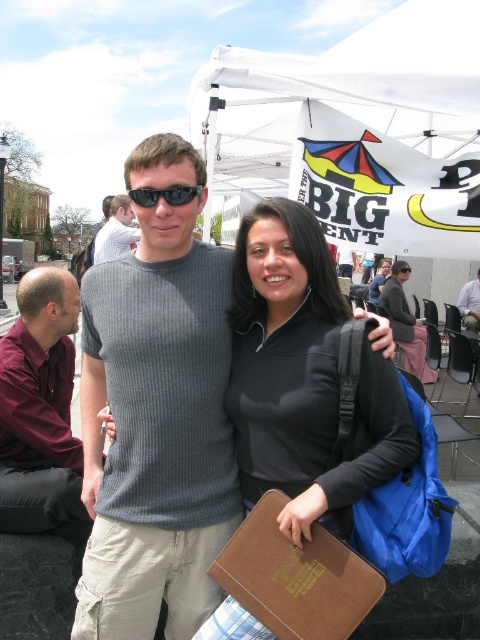
You are a photographer trying to capture a group photo of the black matte jacket at center and the maroon shirt at left. Based on their heights, which person should stand in the back to avoid blocking others?

The black matte jacket at center is much taller than the maroon shirt at left, so the person wearing the black matte jacket at center should stand in the back to avoid blocking others.